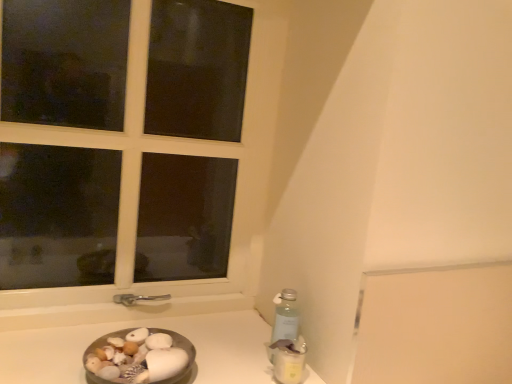
The image size is (512, 384). In order to click on vacant area on top of metallic silver bowl at lower left (from a real-world perspective) in this screenshot , I will do `click(195, 347)`.